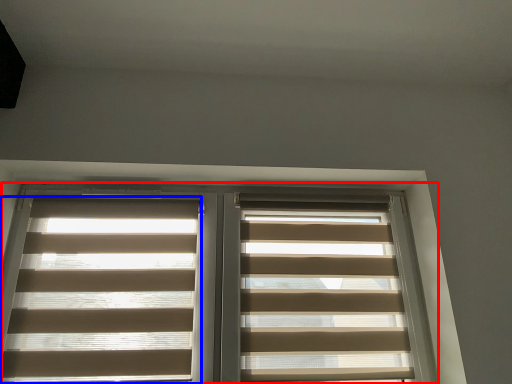
Question: Which point is closer to the camera, window (highlighted by a red box) or window blind (highlighted by a blue box)?

Choices:
 (A) window
 (B) window blind

Answer: (A)